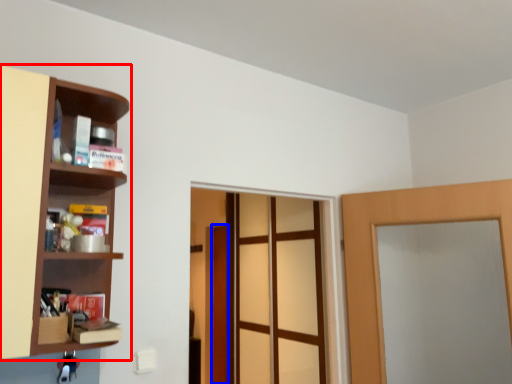
Question: Which point is further to the camera, shelf (highlighted by a red box) or door (highlighted by a blue box)?

Choices:
 (A) shelf
 (B) door

Answer: (B)